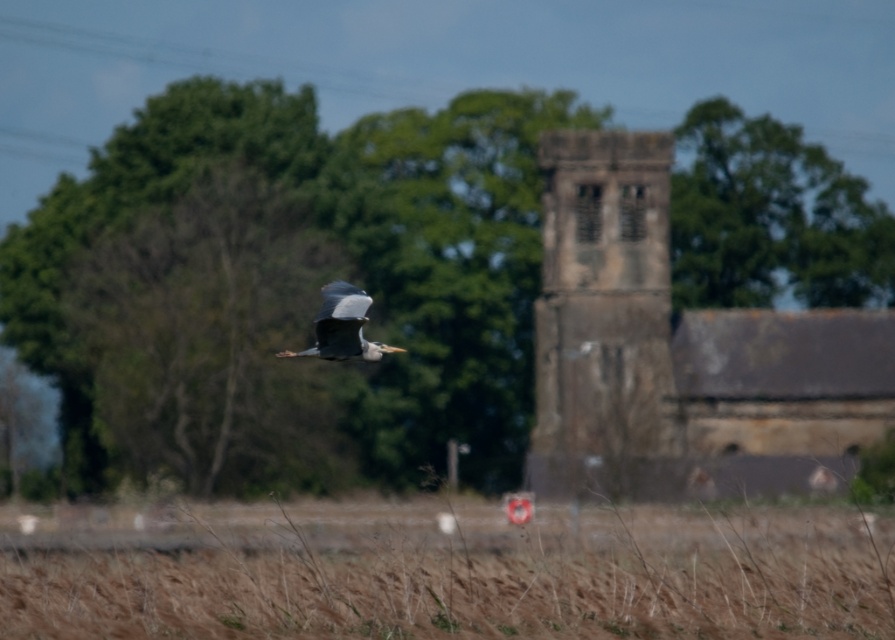
You are a photographer trying to capture both the stone textured church tower at center and the gray feathered bird at center in the same frame. Based on their sizes, which object would appear bigger in your photo?

The stone textured church tower at center appears bigger in the photo because it is larger in size than the gray feathered bird at center.

You are standing in the rural scene and want to determine which point is closer to you. The points are point (x=627, y=204) and point (x=320, y=328). Which point is closer to you?

Point (x=320, y=328) is closer to you because it is less further than point (x=627, y=204).

What are the coordinates of the stone textured church tower at center?

The stone textured church tower at center is located at coordinates point (604,321).